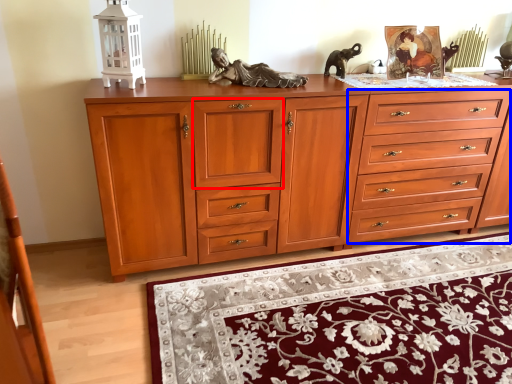
Question: Among these objects, which one is farthest to the camera, drawer (highlighted by a red box) or drawer (highlighted by a blue box)?

Choices:
 (A) drawer
 (B) drawer

Answer: (B)